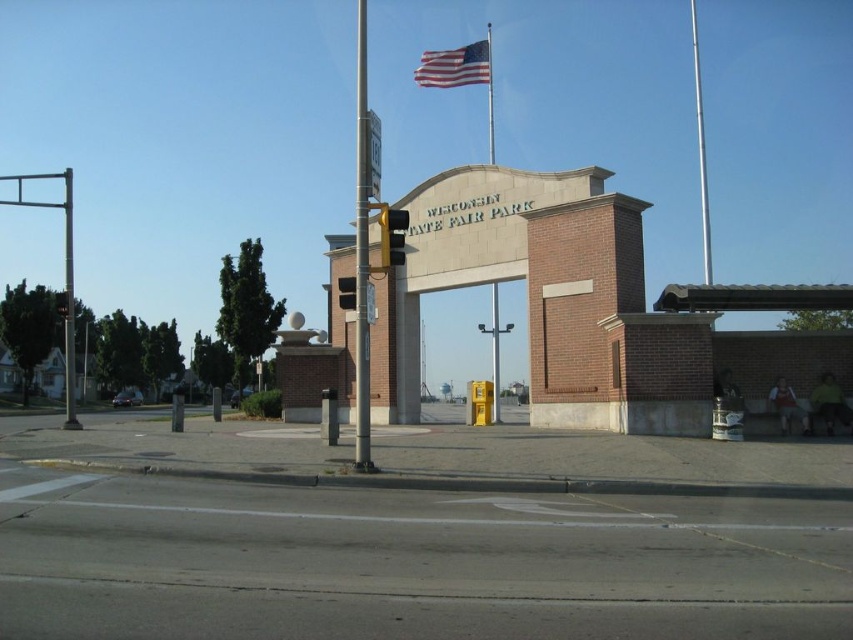
Measure the distance between point (363,316) and camera.

They are 46.77 feet apart.

Is metallic pole at center smaller than silver metallic flag pole at upper center?

No.

Does point (361, 205) lie behind point (698, 163)?

No, (361, 205) is in front of (698, 163).

The height and width of the screenshot is (640, 853). What are the coordinates of `metallic pole at center` in the screenshot? It's located at (361, 256).

Is silver metallic flag pole at upper center thinner than metallic flagpole at upper center?

Yes, silver metallic flag pole at upper center is thinner than metallic flagpole at upper center.

Can you confirm if silver metallic flag pole at upper center is positioned to the left of metallic flagpole at upper center?

In fact, silver metallic flag pole at upper center is to the right of metallic flagpole at upper center.

Image resolution: width=853 pixels, height=640 pixels. In order to click on silver metallic flag pole at upper center in this screenshot , I will do `click(700, 150)`.

Between american flag at upper center and silver metallic flag pole at upper center, which one appears on the left side from the viewer's perspective?

From the viewer's perspective, american flag at upper center appears more on the left side.

Locate an element on the screen. The image size is (853, 640). american flag at upper center is located at coordinates [x=454, y=67].